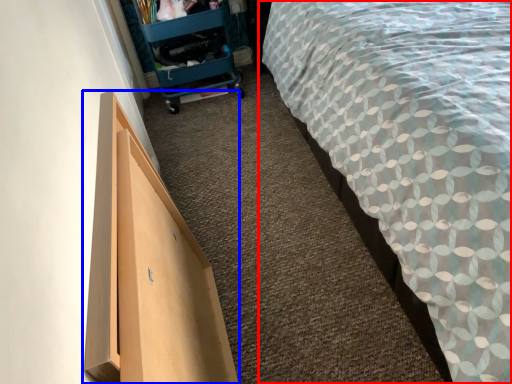
Question: Which object appears farthest to the camera in this image, bed (highlighted by a red box) or furniture (highlighted by a blue box)?

Choices:
 (A) bed
 (B) furniture

Answer: (B)